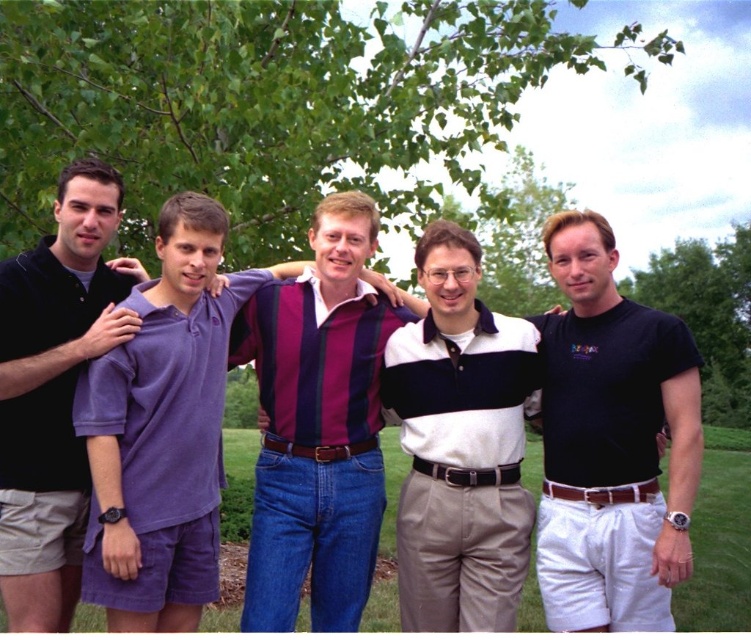
Question: Is green leafy tree at upper center above purple cotton polo shirt at center?

Choices:
 (A) yes
 (B) no

Answer: (A)

Question: Is purple cotton polo shirt at center smaller than green leafy tree at right?

Choices:
 (A) no
 (B) yes

Answer: (A)

Question: Considering the real-world distances, which object is farthest from the black cotton t-shirt at right?

Choices:
 (A) white striped polo shirt at center
 (B) purple cotton polo shirt at center

Answer: (B)

Question: Observing the image, what is the correct spatial positioning of white striped polo shirt at center in reference to velvet black polo shirt at left?

Choices:
 (A) right
 (B) left

Answer: (A)

Question: Which point is farther from the camera taking this photo?

Choices:
 (A) (737, 275)
 (B) (647, 531)
 (C) (65, 508)

Answer: (A)

Question: Among these objects, which one is nearest to the camera?

Choices:
 (A) green leafy tree at upper center
 (B) black cotton t-shirt at right

Answer: (B)